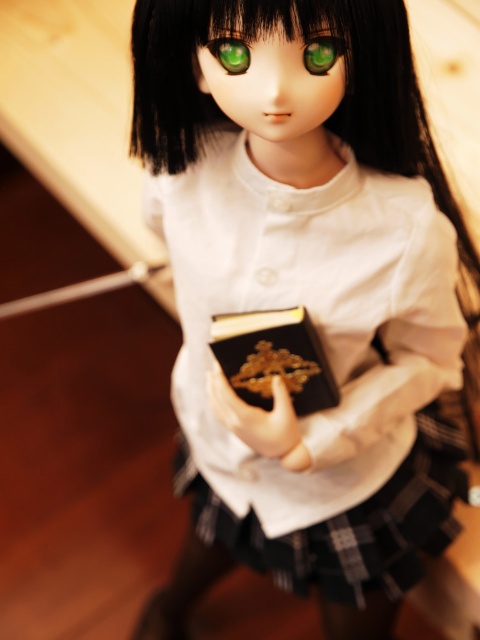
Is point (222, 417) closer to viewer compared to point (321, 45)?

No.

Does smooth gold ring at center have a lesser height compared to green glossy eye at center?

No, smooth gold ring at center is not shorter than green glossy eye at center.

Is point (223, 403) closer to camera compared to point (315, 36)?

No, (223, 403) is further to viewer.

Where is `smooth gold ring at center`? Image resolution: width=480 pixels, height=640 pixels. smooth gold ring at center is located at coordinates click(x=254, y=416).

Who is more distant from viewer, (x=160, y=156) or (x=236, y=353)?

Positioned behind is point (x=236, y=353).

The height and width of the screenshot is (640, 480). What are the coordinates of `white matte uniform at center` in the screenshot? It's located at (302, 285).

Does black leather book at center appear on the left side of smooth gold ring at center?

In fact, black leather book at center is to the right of smooth gold ring at center.

Locate an element on the screen. This screenshot has width=480, height=640. black leather book at center is located at coordinates (274, 356).

Which is behind, point (265, 404) or point (278, 400)?

The point (265, 404) is behind.

The width and height of the screenshot is (480, 640). I want to click on black leather book at center, so click(x=274, y=356).